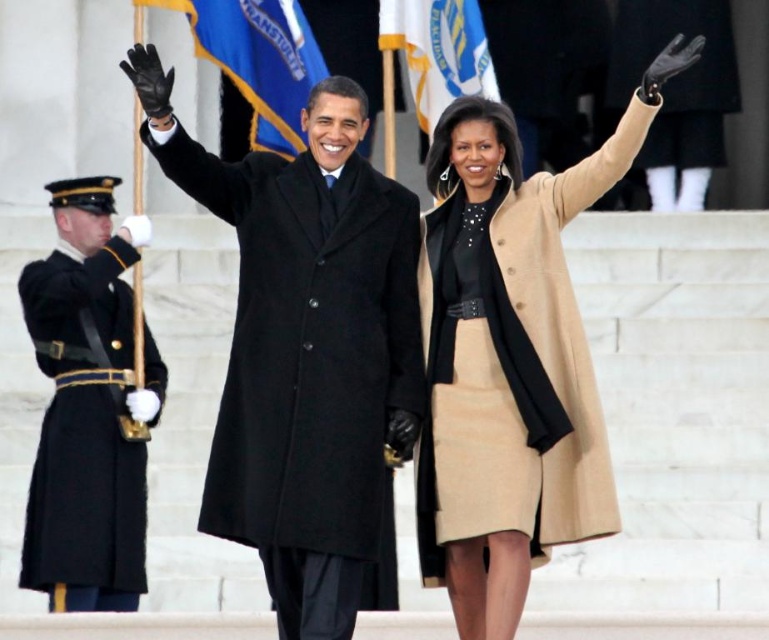
Question: Which object is positioned closest to the blue fabric flag at upper center?

Choices:
 (A) black leather glove at upper center
 (B) white fabric flag at upper center

Answer: (B)

Question: Is black wool uniform at left thinner than black leather glove at upper center?

Choices:
 (A) no
 (B) yes

Answer: (B)

Question: Estimate the real-world distances between objects in this image. Which object is farther from the black leather glove at upper center?

Choices:
 (A) blue fabric flag at upper center
 (B) beige wool coat at center
 (C) black wool uniform at left
 (D) black wool coat at center

Answer: (D)

Question: Which point is farther to the camera?

Choices:
 (A) (55, 288)
 (B) (238, 531)
 (C) (554, 435)

Answer: (A)

Question: Does black wool coat at center appear on the right side of white fabric flag at upper center?

Choices:
 (A) no
 (B) yes

Answer: (A)

Question: Is black wool coat at center to the right of black leather glove at upper center from the viewer's perspective?

Choices:
 (A) yes
 (B) no

Answer: (B)